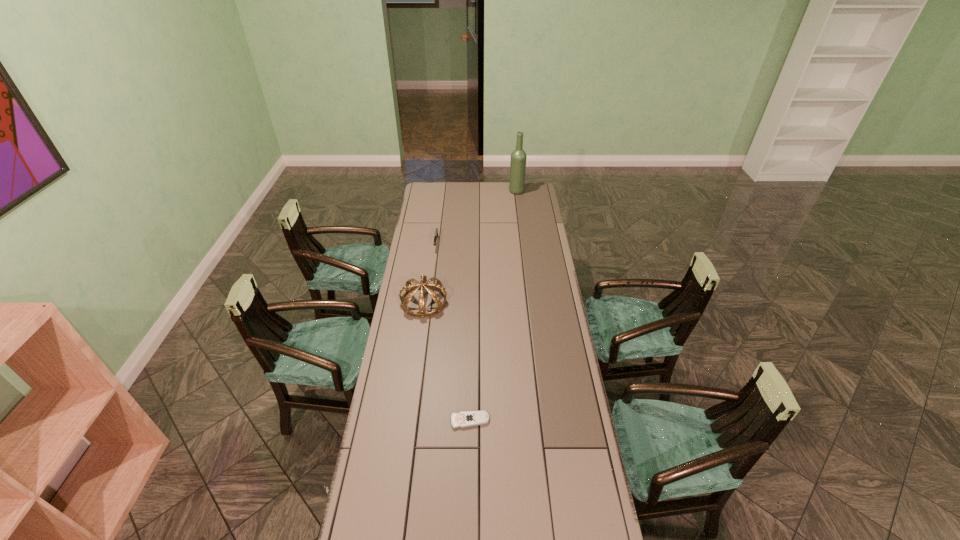
This screenshot has height=540, width=960. What are the coordinates of `vacant point that satisfies the following two spatial constraints: 1. at the muzzle end of the third tallest object; 2. on the left side of the shortest object` in the screenshot? It's located at (415, 421).